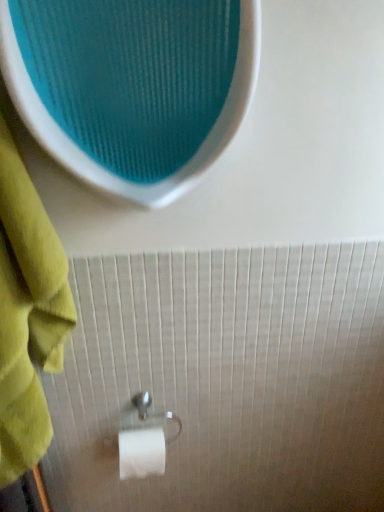
Describe the element at coordinates (144, 438) in the screenshot. The height and width of the screenshot is (512, 384). I see `satin silver toilet paper holder at lower center` at that location.

This screenshot has height=512, width=384. What are the coordinates of `satin silver toilet paper holder at lower center` in the screenshot? It's located at (144, 438).

What is the approximate height of satin silver toilet paper holder at lower center?

The height of satin silver toilet paper holder at lower center is 8.47 inches.

Where is `green cotton towel at left`? The image size is (384, 512). green cotton towel at left is located at coordinates (27, 314).

In order to face green cotton towel at left, should I rotate leftwards or rightwards?

Turn left approximately 24.135 degrees to face it.

The height and width of the screenshot is (512, 384). What do you see at coordinates (27, 314) in the screenshot?
I see `green cotton towel at left` at bounding box center [27, 314].

In order to click on satin silver toilet paper holder at lower center in this screenshot , I will do `click(144, 438)`.

Is green cotton towel at left at the right side of satin silver toilet paper holder at lower center?

No, green cotton towel at left is not to the right of satin silver toilet paper holder at lower center.

Is green cotton towel at left further to the viewer compared to satin silver toilet paper holder at lower center?

That is False.

Does point (6, 328) appear closer or farther from the camera than point (121, 464)?

Point (6, 328).

From the image's perspective, is green cotton towel at left over satin silver toilet paper holder at lower center?

Correct, green cotton towel at left appears higher than satin silver toilet paper holder at lower center in the image.

From a real-world perspective, is green cotton towel at left above or below satin silver toilet paper holder at lower center?

From a real-world perspective, green cotton towel at left is physically above satin silver toilet paper holder at lower center.

Is green cotton towel at left thinner than satin silver toilet paper holder at lower center?

Incorrect, the width of green cotton towel at left is not less than that of satin silver toilet paper holder at lower center.

Is green cotton towel at left taller or shorter than satin silver toilet paper holder at lower center?

Clearly, green cotton towel at left is taller compared to satin silver toilet paper holder at lower center.

Is green cotton towel at left bigger than satin silver toilet paper holder at lower center?

Yes.

Is green cotton towel at left completely or partially outside of satin silver toilet paper holder at lower center?

green cotton towel at left is positioned outside satin silver toilet paper holder at lower center.

Are green cotton towel at left and satin silver toilet paper holder at lower center beside each other?

No, green cotton towel at left is not next to satin silver toilet paper holder at lower center.

Could you tell me if green cotton towel at left is turned towards satin silver toilet paper holder at lower center?

No, green cotton towel at left is not oriented towards satin silver toilet paper holder at lower center.

Can you tell me how much green cotton towel at left and satin silver toilet paper holder at lower center differ in facing direction?

The angle between the facing direction of green cotton towel at left and the facing direction of satin silver toilet paper holder at lower center is 4.16 degrees.

The width and height of the screenshot is (384, 512). Identify the location of towel bar located below the green cotton towel at left (from the image's perspective). (144, 438).

Considering the relative positions of satin silver toilet paper holder at lower center and green cotton towel at left in the image provided, is satin silver toilet paper holder at lower center to the right of green cotton towel at left from the viewer's perspective?

Indeed, satin silver toilet paper holder at lower center is positioned on the right side of green cotton towel at left.

Considering the relative positions of satin silver toilet paper holder at lower center and green cotton towel at left in the image provided, is satin silver toilet paper holder at lower center in front of green cotton towel at left?

No, the depth of satin silver toilet paper holder at lower center is greater than that of green cotton towel at left.

Is point (128, 442) in front of point (37, 381)?

No, (128, 442) is behind (37, 381).

From the image's perspective, is satin silver toilet paper holder at lower center positioned above or below green cotton towel at left?

satin silver toilet paper holder at lower center is situated lower than green cotton towel at left in the image.

Based on the photo, from a real-world perspective, between satin silver toilet paper holder at lower center and green cotton towel at left, who is vertically lower?

In real-world perspective, satin silver toilet paper holder at lower center is lower.

Between satin silver toilet paper holder at lower center and green cotton towel at left, which one has larger width?

green cotton towel at left.

Who is shorter, satin silver toilet paper holder at lower center or green cotton towel at left?

satin silver toilet paper holder at lower center is shorter.

Can you confirm if satin silver toilet paper holder at lower center is smaller than green cotton towel at left?

Indeed, satin silver toilet paper holder at lower center has a smaller size compared to green cotton towel at left.

Is satin silver toilet paper holder at lower center completely or partially outside of green cotton towel at left?

satin silver toilet paper holder at lower center lies outside green cotton towel at left's area.

Would you say satin silver toilet paper holder at lower center is a long distance from green cotton towel at left?

satin silver toilet paper holder at lower center is near green cotton towel at left, not far away.

Is satin silver toilet paper holder at lower center oriented away from green cotton towel at left?

That's not correct — satin silver toilet paper holder at lower center is not looking away from green cotton towel at left.

What's the angular difference between satin silver toilet paper holder at lower center and green cotton towel at left's facing directions?

There is a 4.16-degree angle between the facing directions of satin silver toilet paper holder at lower center and green cotton towel at left.

Identify the location of towel on the left of the satin silver toilet paper holder at lower center. Image resolution: width=384 pixels, height=512 pixels. (27, 314).

Locate an element on the screen. This screenshot has height=512, width=384. towel bar below the green cotton towel at left (from a real-world perspective) is located at coordinates (144, 438).

The width and height of the screenshot is (384, 512). Identify the location of towel that appears on the left of satin silver toilet paper holder at lower center. (27, 314).